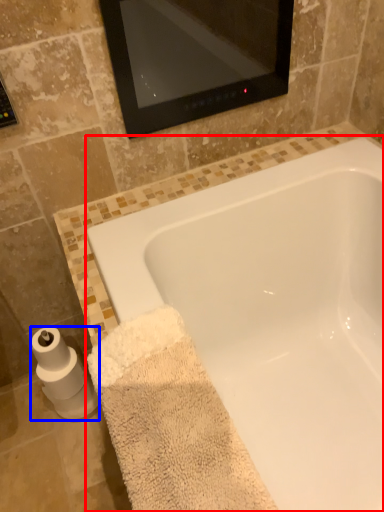
Question: Which point is closer to the camera, bathtub (highlighted by a red box) or toilet paper (highlighted by a blue box)?

Choices:
 (A) bathtub
 (B) toilet paper

Answer: (A)